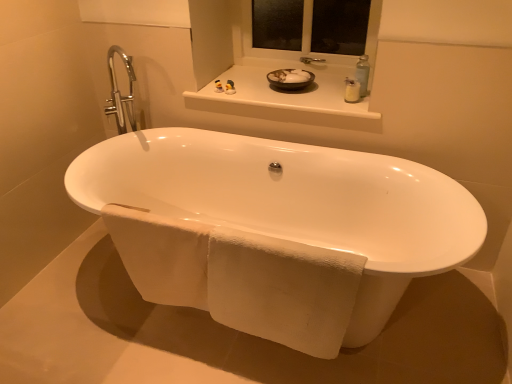
Where is `vacant area on the back side of matte rubber duck at upper center, which appears as the 1th toiletry when viewed from the left`? vacant area on the back side of matte rubber duck at upper center, which appears as the 1th toiletry when viewed from the left is located at coordinates (225, 84).